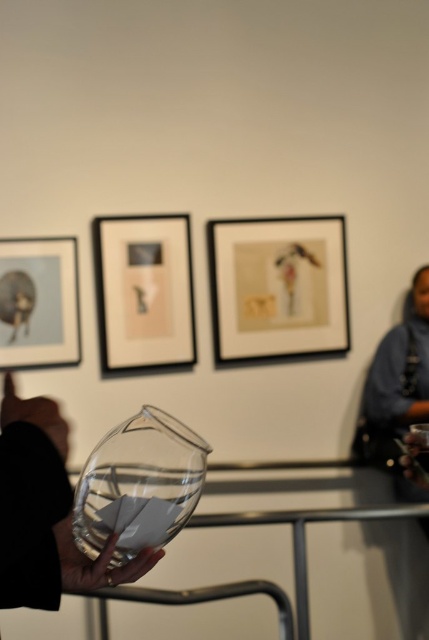
Question: Is matte paper picture frame at center below matte black picture frame at upper center?

Choices:
 (A) yes
 (B) no

Answer: (B)

Question: Which of the following is the closest to the observer?

Choices:
 (A) (39, 337)
 (B) (329, 250)

Answer: (A)

Question: Which point is farther to the camera?

Choices:
 (A) matte black picture frame at upper center
 (B) transparent glass vase at center

Answer: (A)

Question: Does matte black picture frame at upper center appear on the right side of matte glass picture frame at upper left?

Choices:
 (A) no
 (B) yes

Answer: (B)

Question: Which object is closer to the camera taking this photo?

Choices:
 (A) transparent glass vase at center
 (B) matte paper picture frame at center

Answer: (A)

Question: Does matte black picture frame at upper center appear on the left side of transparent glass vase at center?

Choices:
 (A) yes
 (B) no

Answer: (A)